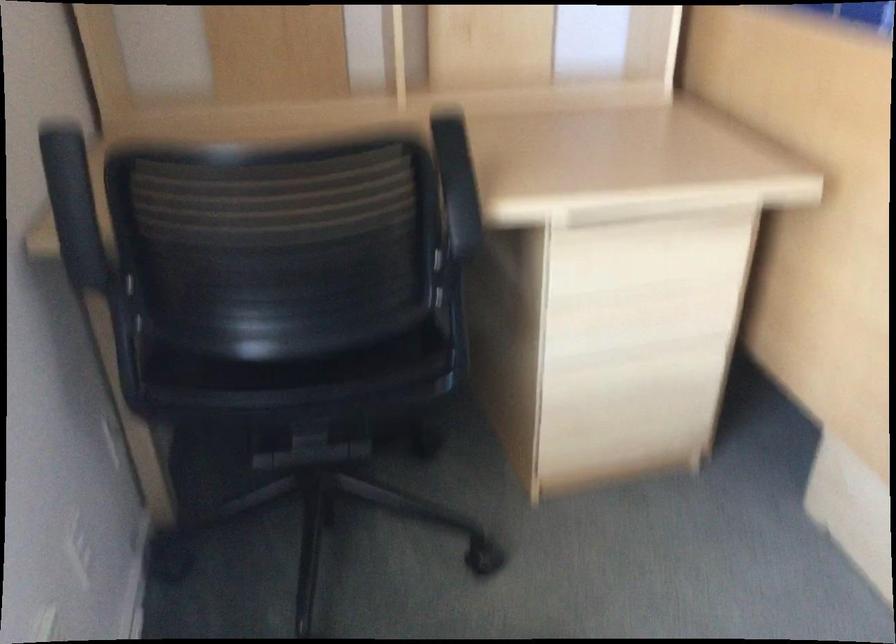
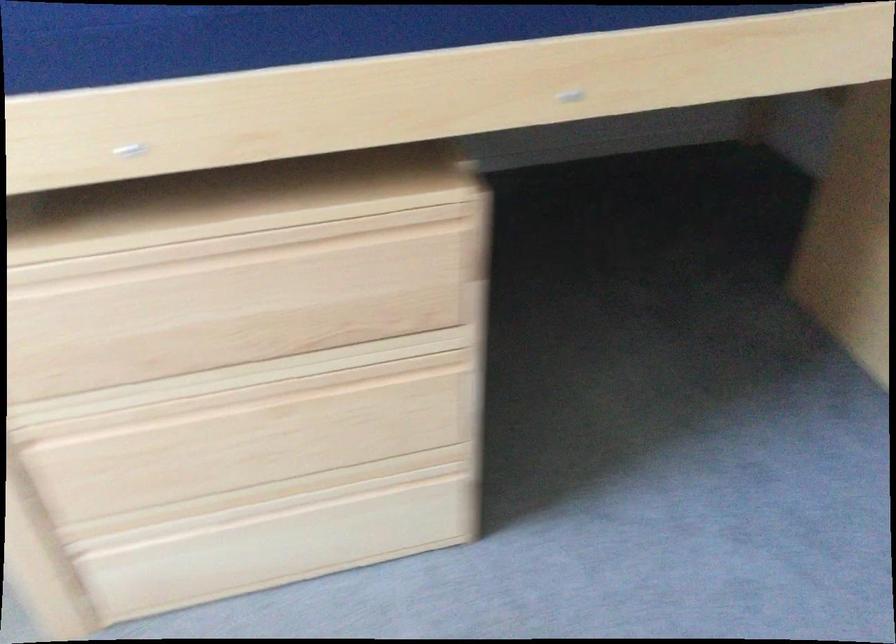
Question: What movement of the cameraman would produce the second image?

Choices:
 (A) Left
 (B) Right
 (C) Forward
 (D) Backward

Answer: (B)